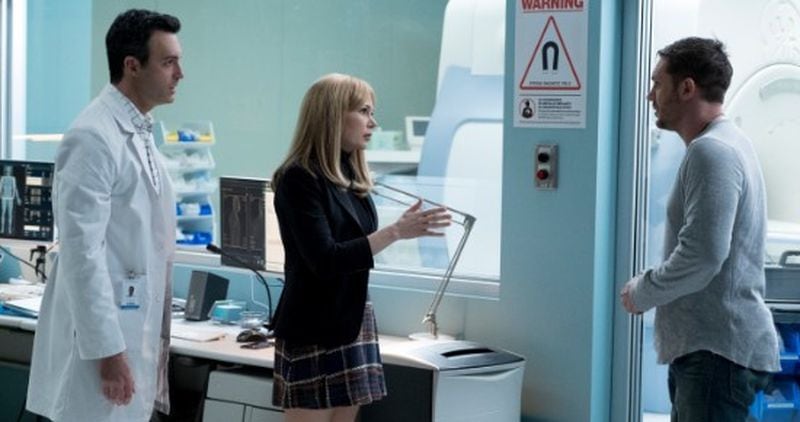
At what (x,y) coordinates should I click in order to perform the action: click on coat. Please return your answer as a coordinate pair (x, y). The image size is (800, 422). Looking at the image, I should click on (114, 191).